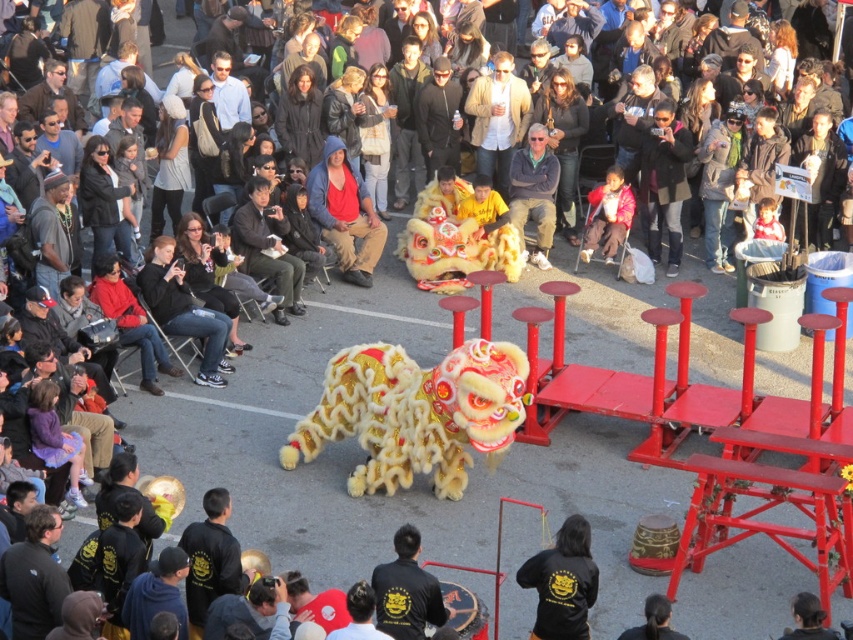
You are a photographer at the festival and want to capture both the black matte jacket at lower center and the black matte jacket at center in a single photo. Which jacket should you focus on to ensure both are visible in the frame?

The black matte jacket at lower center is larger in size compared to the black matte jacket at center, so focusing on the larger jacket will help ensure both are visible in the frame.

You are a photographer at the festival and want to capture both the lion dance performers and the crowd. You are standing at point (386, 358). Which point is behind you, point (360, 273) or the lion dance performers?

Point (360, 273) is behind you because the description states that point (386, 358) is in front of point (360, 273). Since you are at point (386, 358), point (360, 273) would be located behind you.